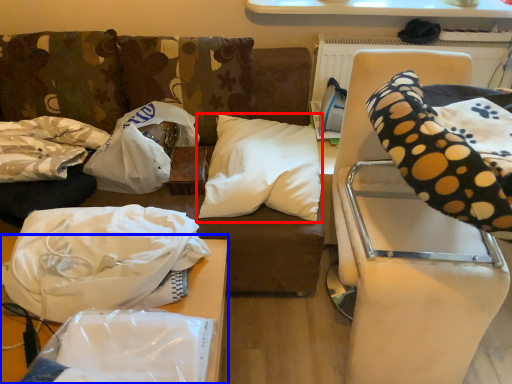
Question: Which object is further to the camera taking this photo, pillow (highlighted by a red box) or furniture (highlighted by a blue box)?

Choices:
 (A) pillow
 (B) furniture

Answer: (A)